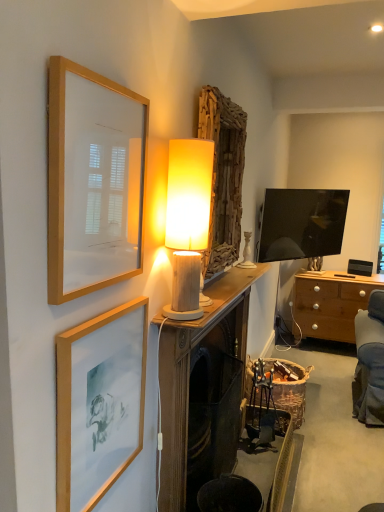
Question: From the image's perspective, would you say wooden framed print at upper left, arranged as the 1th picture frame when viewed from the top, is shown under matte gold picture frame at lower left, which appears as the 2th picture frame when viewed from the top?

Choices:
 (A) yes
 (B) no

Answer: (B)

Question: Is wooden framed print at upper left, the 2th picture frame in the bottom-to-top sequence, oriented away from matte gold picture frame at lower left, which appears as the 2th picture frame when viewed from the top?

Choices:
 (A) yes
 (B) no

Answer: (B)

Question: From a real-world perspective, is wooden framed print at upper left, arranged as the 1th picture frame when viewed from the top, located higher than matte gold picture frame at lower left, which appears as the 2th picture frame when viewed from the top?

Choices:
 (A) yes
 (B) no

Answer: (A)

Question: Is matte gold picture frame at lower left, which appears as the 2th picture frame when viewed from the top, completely or partially inside wooden framed print at upper left, the 2th picture frame in the bottom-to-top sequence?

Choices:
 (A) no
 (B) yes

Answer: (A)

Question: Could you tell me if wooden framed print at upper left, arranged as the 1th picture frame when viewed from the top, is facing matte gold picture frame at lower left, which appears as the 2th picture frame when viewed from the top?

Choices:
 (A) no
 (B) yes

Answer: (A)

Question: Would you say metallic silver swivel chair at lower right is to the left or to the right of wooden framed print at upper left, arranged as the 1th picture frame when viewed from the top, in the picture?

Choices:
 (A) right
 (B) left

Answer: (A)

Question: In terms of height, does metallic silver swivel chair at lower right look taller or shorter compared to wooden framed print at upper left, the 2th picture frame in the bottom-to-top sequence?

Choices:
 (A) short
 (B) tall

Answer: (B)

Question: Based on their sizes in the image, would you say metallic silver swivel chair at lower right is bigger or smaller than wooden framed print at upper left, the 2th picture frame in the bottom-to-top sequence?

Choices:
 (A) small
 (B) big

Answer: (B)

Question: Is metallic silver swivel chair at lower right in front of or behind wooden framed print at upper left, the 2th picture frame in the bottom-to-top sequence, in the image?

Choices:
 (A) behind
 (B) front

Answer: (A)

Question: In the image, is wooden framed print at upper left, the 2th picture frame in the bottom-to-top sequence, positioned in front of or behind metallic silver swivel chair at lower right?

Choices:
 (A) behind
 (B) front

Answer: (B)

Question: Is wooden framed print at upper left, arranged as the 1th picture frame when viewed from the top, taller or shorter than metallic silver swivel chair at lower right?

Choices:
 (A) tall
 (B) short

Answer: (B)

Question: In terms of width, does wooden framed print at upper left, arranged as the 1th picture frame when viewed from the top, look wider or thinner when compared to metallic silver swivel chair at lower right?

Choices:
 (A) thin
 (B) wide

Answer: (A)

Question: Considering the positions of point (94, 243) and point (256, 429), is point (94, 243) closer or farther from the camera than point (256, 429)?

Choices:
 (A) closer
 (B) farther

Answer: (A)

Question: Considering the positions of point (77, 342) and point (311, 330), is point (77, 342) closer or farther from the camera than point (311, 330)?

Choices:
 (A) closer
 (B) farther

Answer: (A)

Question: Based on their positions, is matte gold picture frame at lower left, which is the first picture frame in bottom-to-top order, located to the left or right of wooden chest of drawers at right?

Choices:
 (A) left
 (B) right

Answer: (A)